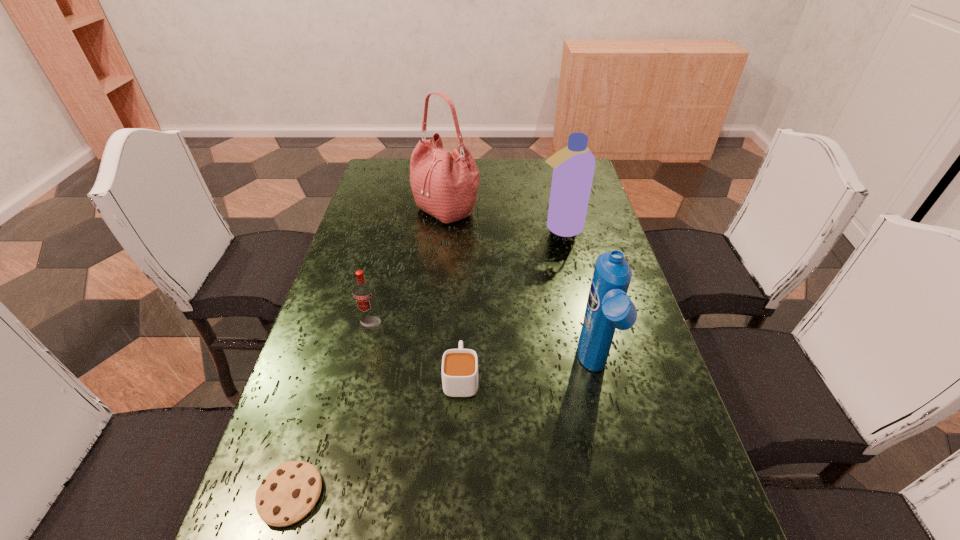
Identify the location of free space at the right edge. The image size is (960, 540). (591, 251).

At what (x,y) coordinates should I click in order to perform the action: click on vacant space at the far left corner. Please return your answer as a coordinate pair (x, y). Looking at the image, I should click on (378, 161).

Find the location of a particular element. unoccupied area between the handbag and the nearer shampoo is located at coordinates (520, 289).

Identify the location of vacant space that is in between the fourth nearest object and the tallest object. This screenshot has width=960, height=540. [x=409, y=266].

At what (x,y) coordinates should I click in order to perform the action: click on vacant area that lies between the handbag and the cup. Please return your answer as a coordinate pair (x, y). This screenshot has width=960, height=540. Looking at the image, I should click on (453, 293).

I want to click on vacant area between the fourth tallest object and the handbag, so click(x=409, y=266).

Identify the location of vacant area that lies between the nearest object and the fifth tallest object. (375, 436).

This screenshot has height=540, width=960. Identify the location of free space between the second shortest object and the handbag. (453, 293).

The width and height of the screenshot is (960, 540). What are the coordinates of `vacant area that lies between the vodka and the farther shampoo` in the screenshot? It's located at (466, 275).

Where is `free spot between the shortest object and the third shortest object`? The width and height of the screenshot is (960, 540). free spot between the shortest object and the third shortest object is located at coordinates (331, 409).